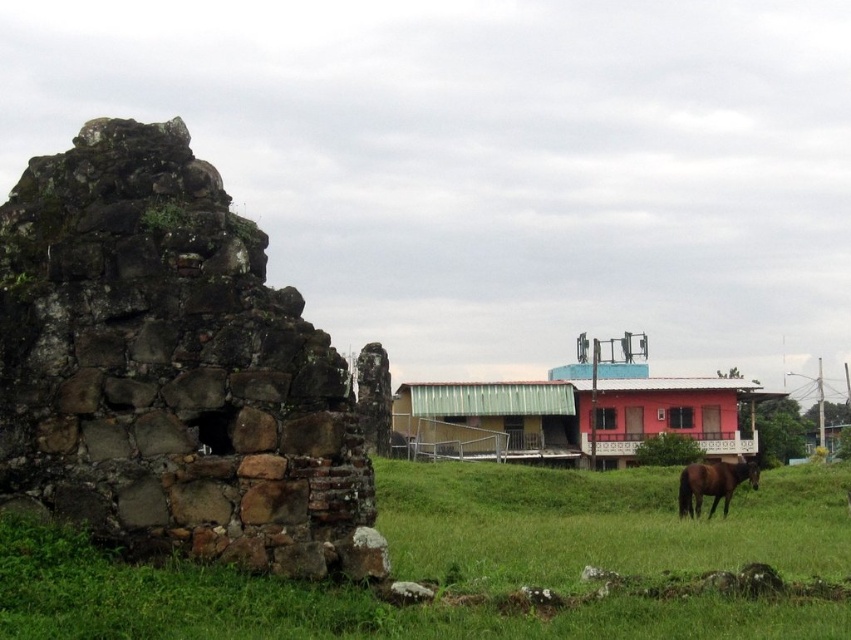
Question: Is green corrugated metal hut at center positioned behind brown glossy horse at lower right?

Choices:
 (A) no
 (B) yes

Answer: (B)

Question: Can you confirm if brown stone ruins at left is positioned above green corrugated metal hut at center?

Choices:
 (A) no
 (B) yes

Answer: (B)

Question: Among these points, which one is nearest to the camera?

Choices:
 (A) (634, 547)
 (B) (734, 464)

Answer: (A)

Question: Considering the relative positions of green corrugated metal hut at center and brown glossy horse at lower right in the image provided, where is green corrugated metal hut at center located with respect to brown glossy horse at lower right?

Choices:
 (A) above
 (B) below

Answer: (B)

Question: Which of the following is the closest to the observer?

Choices:
 (A) (49, 296)
 (B) (540, 564)
 (C) (746, 465)
 (D) (415, 417)

Answer: (A)

Question: Among these points, which one is nearest to the camera?

Choices:
 (A) (478, 493)
 (B) (421, 388)
 (C) (740, 465)
 (D) (101, 522)

Answer: (D)